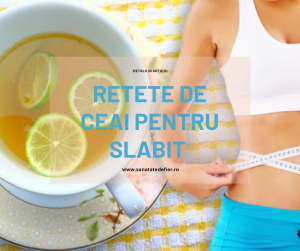
You are a GUI agent. You are given a task and a screenshot of the screen. Output one action in this format:
    pyautogui.click(x=<x>, y=<y>)
    Task: Click on the yellow and white table cloth
    The height and width of the screenshot is (251, 300).
    Given the screenshot: What is the action you would take?
    coord(175,236)